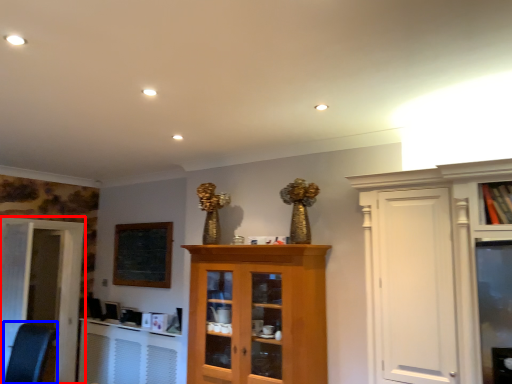
Question: Which object appears closest to the camera in this image, door (highlighted by a red box) or swivel chair (highlighted by a blue box)?

Choices:
 (A) door
 (B) swivel chair

Answer: (B)